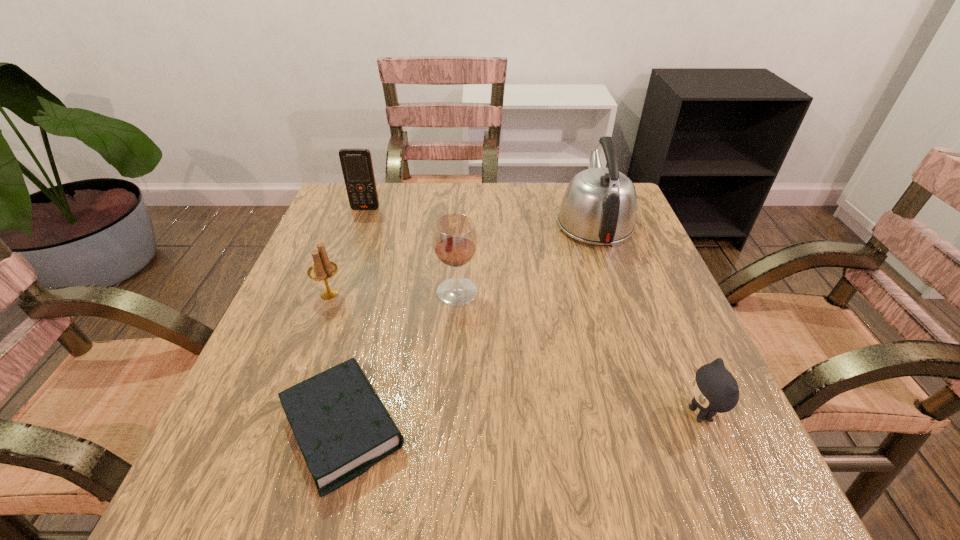
Locate an element on the screen. free space located 0.390m on the front of the candle holder is located at coordinates (250, 506).

I want to click on vacant space located on the front-facing side of the second shortest object, so click(x=462, y=414).

Identify the location of vacant space located on the front-facing side of the second shortest object. (638, 414).

This screenshot has height=540, width=960. What are the coordinates of `vacant space situated 0.060m on the front-facing side of the second shortest object` in the screenshot? It's located at (644, 414).

Where is `vacant space located on the back of the shortest object`? vacant space located on the back of the shortest object is located at coordinates (373, 310).

Where is `kettle that is at the far edge`? kettle that is at the far edge is located at coordinates (599, 206).

The image size is (960, 540). Find the location of `cellular telephone positioned at the far edge`. cellular telephone positioned at the far edge is located at coordinates (356, 163).

In order to click on object located at the near edge in this screenshot , I will do `click(342, 427)`.

Where is `cellular telephone located in the left edge section of the desktop`? The width and height of the screenshot is (960, 540). cellular telephone located in the left edge section of the desktop is located at coordinates (356, 163).

Find the location of a particular element. The image size is (960, 540). candle holder positioned at the left edge is located at coordinates (322, 269).